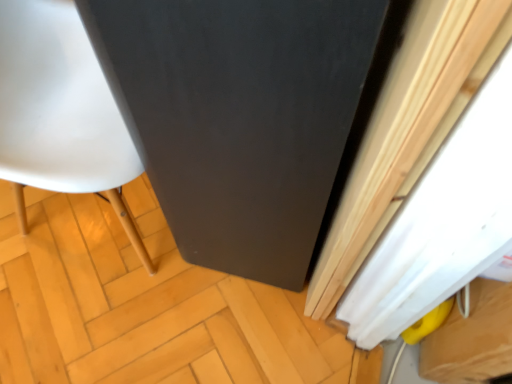
Question: From a real-world perspective, is black matte screen door at center located higher than matte black cabinet at center?

Choices:
 (A) no
 (B) yes

Answer: (B)

Question: From the image's perspective, is black matte screen door at center located above matte black cabinet at center?

Choices:
 (A) no
 (B) yes

Answer: (B)

Question: Is black matte screen door at center smaller than matte black cabinet at center?

Choices:
 (A) no
 (B) yes

Answer: (A)

Question: Is black matte screen door at center turned away from matte black cabinet at center?

Choices:
 (A) no
 (B) yes

Answer: (A)

Question: Does black matte screen door at center turn towards matte black cabinet at center?

Choices:
 (A) no
 (B) yes

Answer: (A)

Question: Are black matte screen door at center and matte black cabinet at center making contact?

Choices:
 (A) no
 (B) yes

Answer: (A)

Question: Is matte black cabinet at center to the right of white matte curtain at right from the viewer's perspective?

Choices:
 (A) no
 (B) yes

Answer: (A)

Question: Would you say matte black cabinet at center is a long distance from white matte curtain at right?

Choices:
 (A) yes
 (B) no

Answer: (B)

Question: Does matte black cabinet at center have a lesser height compared to white matte curtain at right?

Choices:
 (A) yes
 (B) no

Answer: (A)

Question: Is matte black cabinet at center further to camera compared to white matte curtain at right?

Choices:
 (A) no
 (B) yes

Answer: (B)

Question: Can we say matte black cabinet at center lies outside white matte curtain at right?

Choices:
 (A) yes
 (B) no

Answer: (A)

Question: From a real-world perspective, is matte black cabinet at center physically above white matte curtain at right?

Choices:
 (A) no
 (B) yes

Answer: (A)

Question: Can you confirm if matte black cabinet at center is wider than black matte screen door at center?

Choices:
 (A) yes
 (B) no

Answer: (A)